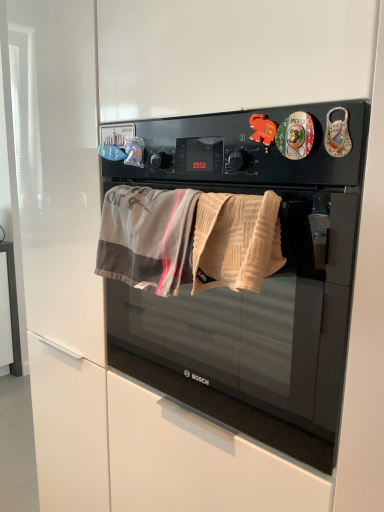
Question: Is black matte microwave oven at center not inside beige textured towel at center, which ranks as the second beach towel in left-to-right order?

Choices:
 (A) no
 (B) yes

Answer: (B)

Question: Is the depth of black matte microwave oven at center greater than that of beige textured towel at center, which ranks as the second beach towel in left-to-right order?

Choices:
 (A) no
 (B) yes

Answer: (A)

Question: Does black matte microwave oven at center have a lesser height compared to beige textured towel at center, the 1th beach towel from the right?

Choices:
 (A) no
 (B) yes

Answer: (A)

Question: Does black matte microwave oven at center appear on the left side of beige textured towel at center, which ranks as the second beach towel in left-to-right order?

Choices:
 (A) yes
 (B) no

Answer: (B)

Question: Is black matte microwave oven at center facing away from beige textured towel at center, the 1th beach towel from the right?

Choices:
 (A) yes
 (B) no

Answer: (B)

Question: Is black matte microwave oven at center beside beige textured towel at center, the 1th beach towel from the right?

Choices:
 (A) no
 (B) yes

Answer: (A)

Question: Considering the relative sizes of beige textured towel at center, which ranks as the second beach towel in left-to-right order, and gray cotton beach towel at center, which appears as the first beach towel when viewed from the left, in the image provided, is beige textured towel at center, which ranks as the second beach towel in left-to-right order, wider than gray cotton beach towel at center, which appears as the first beach towel when viewed from the left,?

Choices:
 (A) no
 (B) yes

Answer: (A)

Question: Is beige textured towel at center, which ranks as the second beach towel in left-to-right order, at the left side of gray cotton beach towel at center, which appears as the first beach towel when viewed from the left?

Choices:
 (A) no
 (B) yes

Answer: (A)

Question: Is beige textured towel at center, the 1th beach towel from the right, aimed at gray cotton beach towel at center, the second beach towel from the right?

Choices:
 (A) no
 (B) yes

Answer: (A)

Question: Considering the relative positions of beige textured towel at center, the 1th beach towel from the right, and gray cotton beach towel at center, the second beach towel from the right, in the image provided, is beige textured towel at center, the 1th beach towel from the right, behind gray cotton beach towel at center, the second beach towel from the right,?

Choices:
 (A) no
 (B) yes

Answer: (A)

Question: Can you confirm if beige textured towel at center, the 1th beach towel from the right, is taller than gray cotton beach towel at center, the second beach towel from the right?

Choices:
 (A) no
 (B) yes

Answer: (A)

Question: From a real-world perspective, is beige textured towel at center, the 1th beach towel from the right, on top of gray cotton beach towel at center, which appears as the first beach towel when viewed from the left?

Choices:
 (A) yes
 (B) no

Answer: (A)

Question: Considering the relative sizes of black matte microwave oven at center and gray cotton beach towel at center, the second beach towel from the right, in the image provided, is black matte microwave oven at center thinner than gray cotton beach towel at center, the second beach towel from the right,?

Choices:
 (A) yes
 (B) no

Answer: (B)